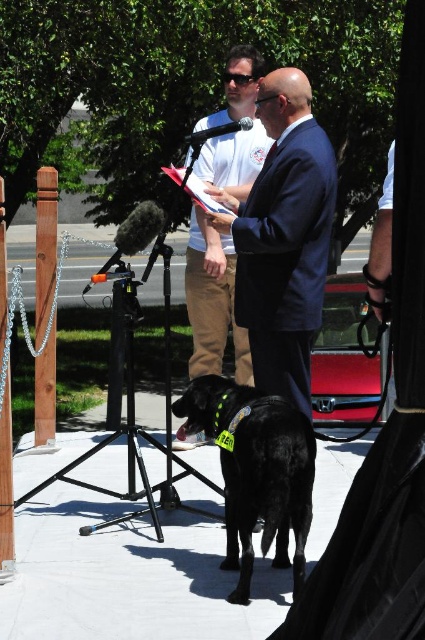
Does black matte dog at center lie behind white cotton shirt at center?

No.

This screenshot has height=640, width=425. Find the location of `black matte dog at center`. black matte dog at center is located at coordinates (255, 470).

Does dark blue suit at center have a greater height compared to white cotton shirt at center?

No, dark blue suit at center is not taller than white cotton shirt at center.

Is dark blue suit at center closer to the viewer compared to white cotton shirt at center?

Yes, dark blue suit at center is in front of white cotton shirt at center.

Find the location of a particular element. This screenshot has width=425, height=640. dark blue suit at center is located at coordinates [x=283, y=237].

Does dark blue suit at center have a larger size compared to black matte dog at center?

No.

Is point (302, 188) less distant than point (277, 563)?

No.

Who is more forward, (294, 106) or (192, 417)?

Point (294, 106)

The image size is (425, 640). I want to click on dark blue suit at center, so click(x=283, y=237).